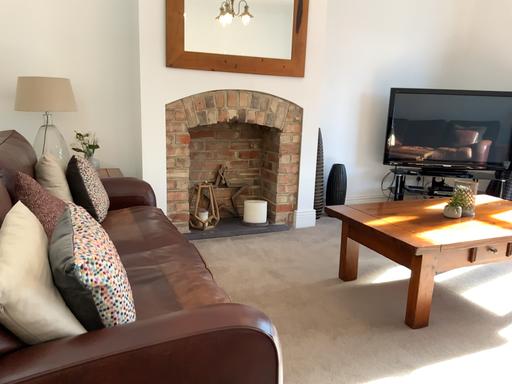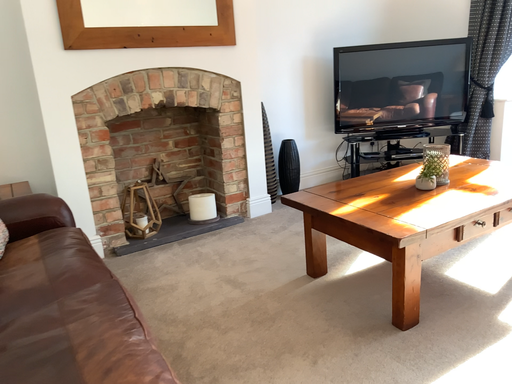
Question: How did the camera likely rotate when shooting the video?

Choices:
 (A) rotated left
 (B) rotated right

Answer: (B)